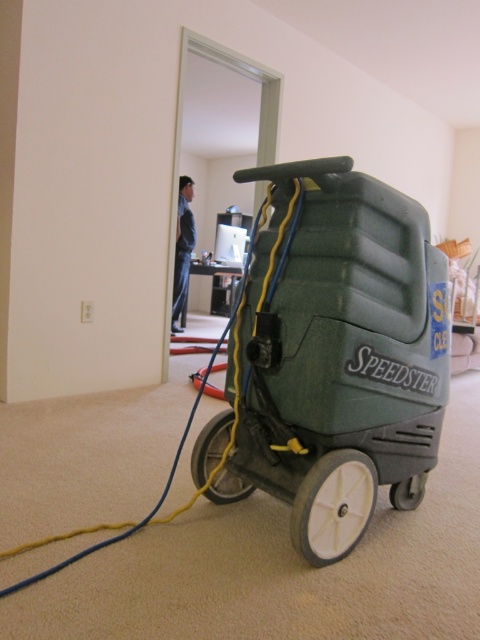
Image resolution: width=480 pixels, height=640 pixels. What do you see at coordinates (339, 355) in the screenshot?
I see `green plastic carpet cleaner at center` at bounding box center [339, 355].

Is point (371, 285) positioned after point (394, 493)?

No, it is not.

Between point (372, 244) and point (404, 506), which one is positioned behind?

The point (404, 506) is more distant.

Locate an element on the screen. green plastic carpet cleaner at center is located at coordinates (339, 355).

Between green plastic carpet cleaner at center and blue jeans at center, which one has less height?

green plastic carpet cleaner at center is shorter.

Does green plastic carpet cleaner at center have a greater width compared to blue jeans at center?

Correct, the width of green plastic carpet cleaner at center exceeds that of blue jeans at center.

Where is `green plastic carpet cleaner at center`? The height and width of the screenshot is (640, 480). green plastic carpet cleaner at center is located at coordinates (339, 355).

Image resolution: width=480 pixels, height=640 pixels. Find the location of `green plastic carpet cleaner at center`. green plastic carpet cleaner at center is located at coordinates (339, 355).

Can you confirm if white rubber wheel at center is positioned below blue jeans at center?

Correct, white rubber wheel at center is located below blue jeans at center.

Does white rubber wheel at center appear on the right side of blue jeans at center?

Indeed, white rubber wheel at center is positioned on the right side of blue jeans at center.

Between point (322, 490) and point (182, 282), which one is positioned in front?

Point (322, 490) is in front.

I want to click on white rubber wheel at center, so click(x=333, y=506).